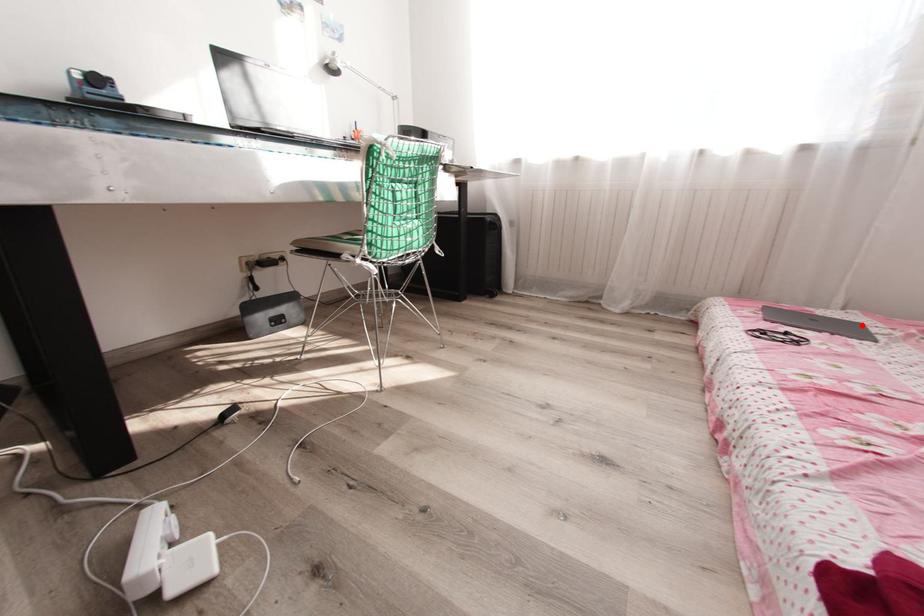
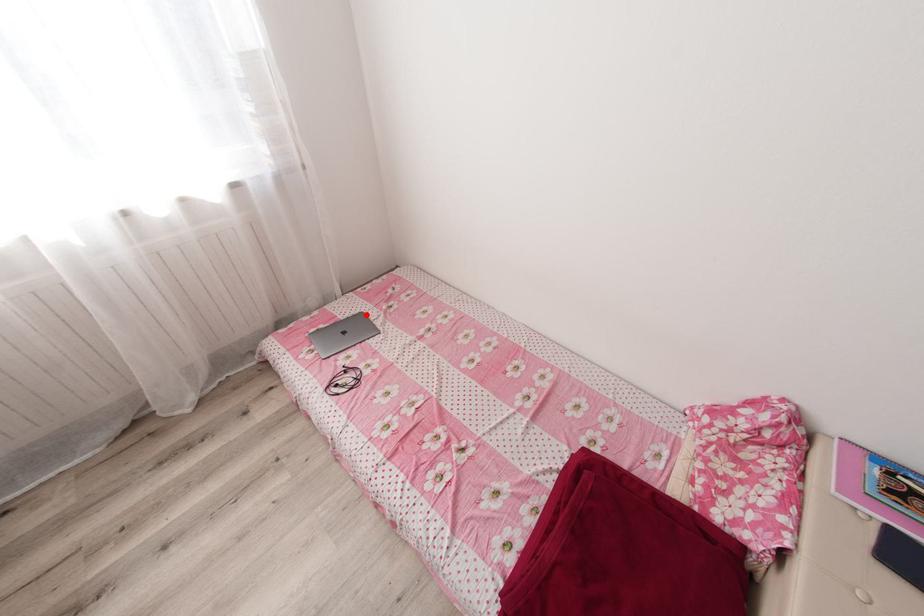
I am providing you with two images of the same scene from different viewpoints. A red point is marked on the first image and another point is marked on the second image. Do the highlighted points in image1 and image2 indicate the same real-world spot?

Yes